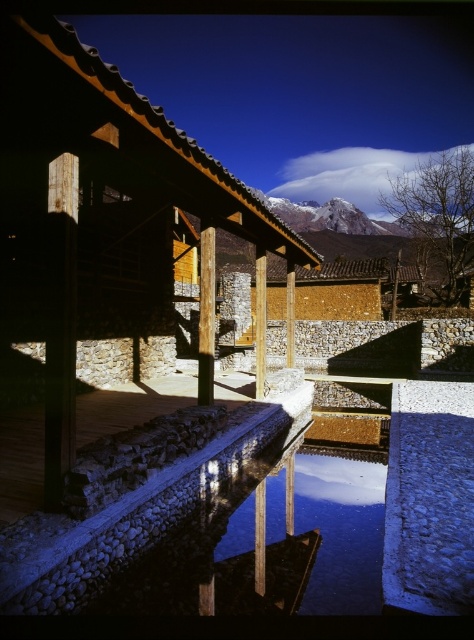
Who is more forward, (51, 214) or (208, 282)?

Positioned in front is point (51, 214).

Does wooden post at center have a greater height compared to matte wood pillar at center?

Indeed, wooden post at center has a greater height compared to matte wood pillar at center.

The image size is (474, 640). Describe the element at coordinates (61, 324) in the screenshot. I see `wooden post at center` at that location.

This screenshot has width=474, height=640. In order to click on wooden post at center in this screenshot , I will do `click(61, 324)`.

Between point (333, 557) and point (74, 310), which one is positioned in front?

Point (74, 310) is in front.

Can you confirm if transparent glass water at center is smaller than wooden post at center?

Correct, transparent glass water at center occupies less space than wooden post at center.

Who is more distant from viewer, (343, 588) or (67, 252)?

The point (343, 588) is behind.

Where is `transparent glass water at center`? transparent glass water at center is located at coordinates [342, 529].

Who is higher up, matte wood pillar at center or smooth stone pillar at center?

smooth stone pillar at center is higher up.

Does matte wood pillar at center have a lesser width compared to smooth stone pillar at center?

Incorrect, matte wood pillar at center's width is not less than smooth stone pillar at center's.

Which is behind, point (200, 376) or point (256, 336)?

The point (256, 336) is more distant.

The height and width of the screenshot is (640, 474). What are the coordinates of `matte wood pillar at center` in the screenshot? It's located at (206, 316).